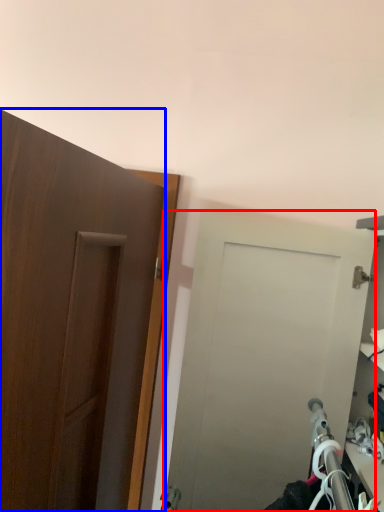
Question: Which point is further to the camera, door (highlighted by a red box) or door (highlighted by a blue box)?

Choices:
 (A) door
 (B) door

Answer: (A)